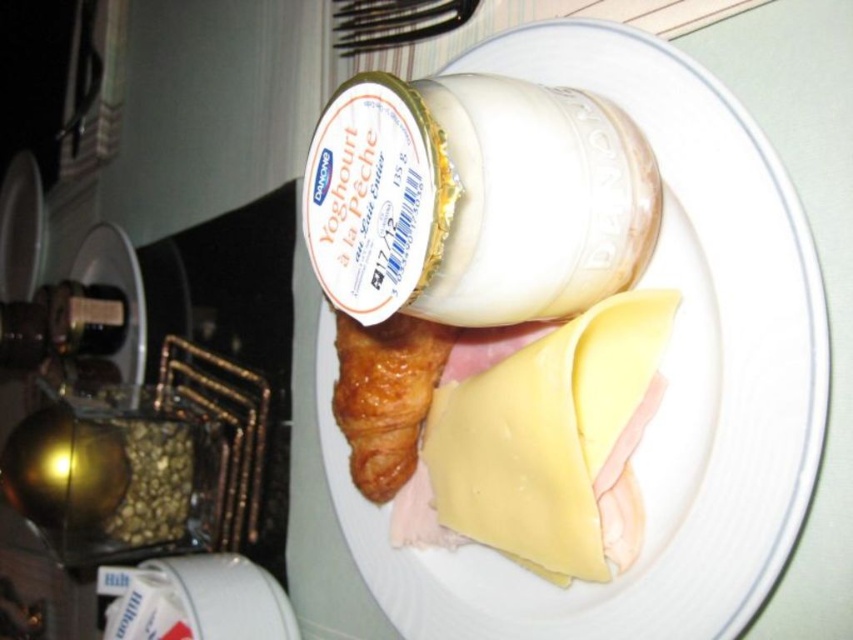
Does white matte yogurt container at upper center have a lesser width compared to golden brown flaky croissant at center?

No.

Which is behind, point (329, 465) or point (380, 500)?

The point (329, 465) is more distant.

Between point (560, 598) and point (373, 356), which one is positioned behind?

The point (373, 356) is behind.

At what (x,y) coordinates should I click in order to perform the action: click on white matte yogurt container at upper center. Please return your answer as a coordinate pair (x, y). Looking at the image, I should click on (663, 371).

Does yellow cheese at center appear under golden brown flaky croissant at center?

Correct, yellow cheese at center is located below golden brown flaky croissant at center.

Who is more forward, (631, 342) or (354, 406)?

Positioned in front is point (631, 342).

Between point (503, 506) and point (424, 330), which one is positioned in front?

Point (503, 506) is more forward.

What are the coordinates of `yellow cheese at center` in the screenshot? It's located at (544, 435).

Between point (323, 417) and point (599, 429), which one is positioned in front?

Point (599, 429) is more forward.

How much distance is there between white matte yogurt container at upper center and yellow cheese at center?

white matte yogurt container at upper center is 4.08 inches away from yellow cheese at center.

Identify the location of white matte yogurt container at upper center. (663, 371).